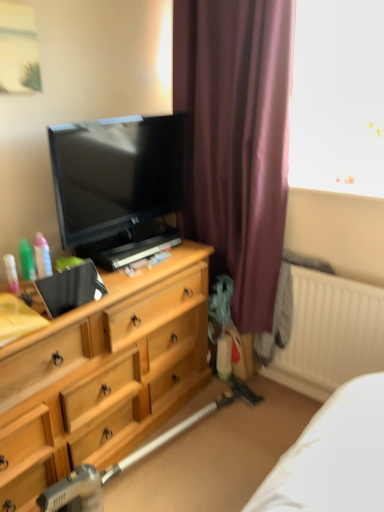
Question: Can you confirm if translucent plastic bottles at left, the first toiletry from the right, is smaller than metallic silver vacuum cleaner at lower center?

Choices:
 (A) yes
 (B) no

Answer: (A)

Question: Is translucent plastic bottles at left, the first toiletry from the right, not inside metallic silver vacuum cleaner at lower center?

Choices:
 (A) no
 (B) yes

Answer: (B)

Question: Is the surface of translucent plastic bottles at left, the first toiletry from the right, in direct contact with metallic silver vacuum cleaner at lower center?

Choices:
 (A) no
 (B) yes

Answer: (A)

Question: Is translucent plastic bottles at left, arranged as the 3th toiletry when viewed from the left, taller than metallic silver vacuum cleaner at lower center?

Choices:
 (A) no
 (B) yes

Answer: (A)

Question: From a real-world perspective, is translucent plastic bottles at left, the first toiletry from the right, located higher than metallic silver vacuum cleaner at lower center?

Choices:
 (A) no
 (B) yes

Answer: (B)

Question: Considering the positions of matte black tv at left and wooden chest of drawers at left in the image, is matte black tv at left taller or shorter than wooden chest of drawers at left?

Choices:
 (A) tall
 (B) short

Answer: (B)

Question: Is point (130, 245) closer or farther from the camera than point (127, 392)?

Choices:
 (A) closer
 (B) farther

Answer: (B)

Question: Looking at their shapes, would you say matte black tv at left is wider or thinner than wooden chest of drawers at left?

Choices:
 (A) wide
 (B) thin

Answer: (B)

Question: From the image's perspective, is matte black tv at left positioned above or below wooden chest of drawers at left?

Choices:
 (A) below
 (B) above

Answer: (B)

Question: Considering the positions of metallic silver vacuum cleaner at lower center and purple fabric curtain at center in the image, is metallic silver vacuum cleaner at lower center bigger or smaller than purple fabric curtain at center?

Choices:
 (A) small
 (B) big

Answer: (A)

Question: Visually, is metallic silver vacuum cleaner at lower center positioned to the left or to the right of purple fabric curtain at center?

Choices:
 (A) right
 (B) left

Answer: (B)

Question: Relative to purple fabric curtain at center, is metallic silver vacuum cleaner at lower center in front or behind?

Choices:
 (A) behind
 (B) front

Answer: (B)

Question: Considering the positions of metallic silver vacuum cleaner at lower center and purple fabric curtain at center in the image, is metallic silver vacuum cleaner at lower center wider or thinner than purple fabric curtain at center?

Choices:
 (A) wide
 (B) thin

Answer: (B)

Question: Is purple fabric curtain at center situated inside translucent plastic spray bottle at left, which is counted as the 1th toiletry, starting from the left, or outside?

Choices:
 (A) outside
 (B) inside

Answer: (A)

Question: Considering the positions of purple fabric curtain at center and translucent plastic spray bottle at left, the 3th toiletry when ordered from right to left, in the image, is purple fabric curtain at center taller or shorter than translucent plastic spray bottle at left, the 3th toiletry when ordered from right to left,?

Choices:
 (A) short
 (B) tall

Answer: (B)